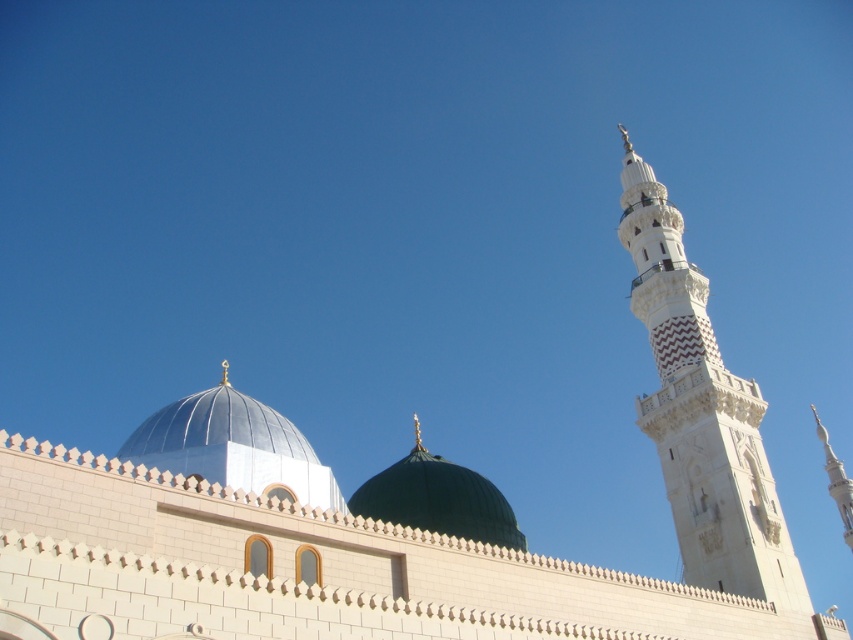
You are a photographer planning to capture the mosque from a distance. You want to ensure both the white stone minaret at right and the metallic silver dome at center are clearly visible in your shot. Given their heights, which one will appear taller in the photograph?

The white stone minaret at right is much taller than the metallic silver dome at center, so it will appear taller in the photograph.

You are standing in front of the mosque and want to locate the metallic silver dome at center. Based on the coordinates provided, where should you look relative to the other structures in the image?

The metallic silver dome at center is located at coordinates 0.698 on the x axis and 0.274 on the y axis, so you should look towards the upper right side of the image relative to the other structures.

You are an architect analyzing the mosque design. You notice two domes at the center. Which dome, the metallic silver dome at center or the green matte dome at center, has a larger diameter?

The metallic silver dome at center is wider than the green matte dome at center according to the description.